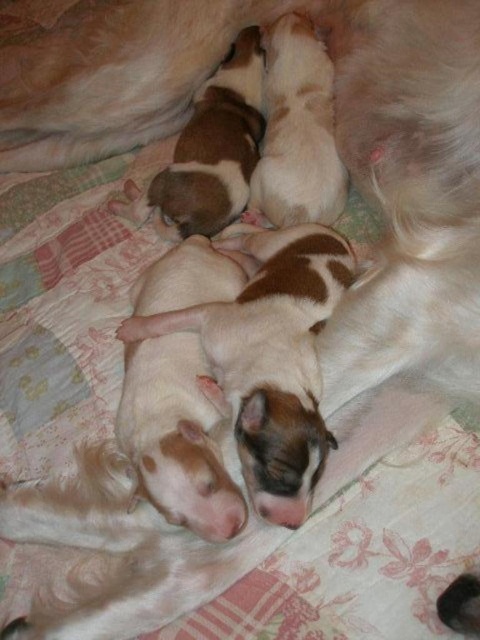
Is white fur puppies at center taller than brown and white fur at center?

No.

You are a GUI agent. You are given a task and a screenshot of the screen. Output one action in this format:
    pyautogui.click(x=<x>, y=<y>)
    Task: Click on the white fur puppies at center
    Image resolution: width=480 pixels, height=640 pixels.
    Given the screenshot: What is the action you would take?
    pyautogui.click(x=269, y=358)

What do you see at coordinates (269, 358) in the screenshot? The image size is (480, 640). I see `white fur puppies at center` at bounding box center [269, 358].

Locate an element on the screen. The image size is (480, 640). white fur puppies at center is located at coordinates coord(269,358).